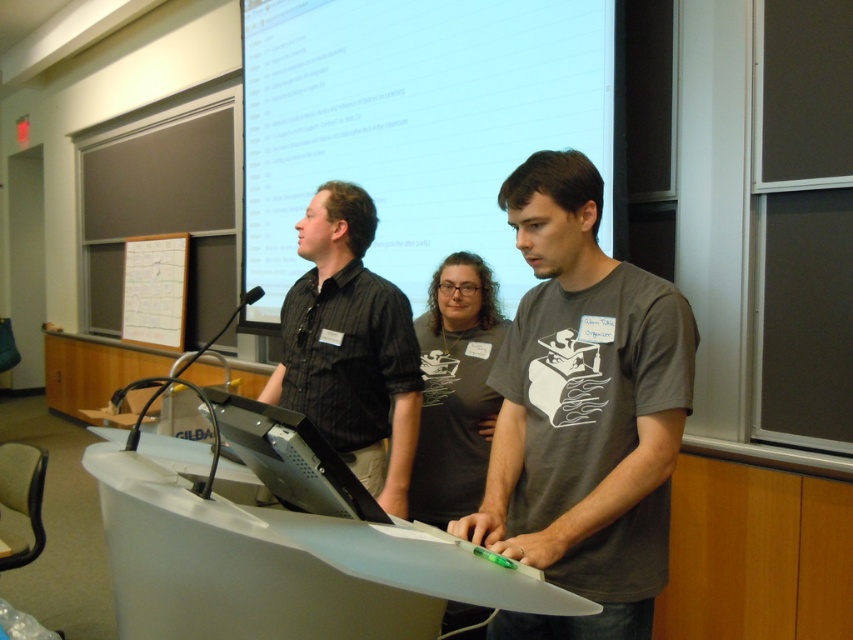
Question: Does black striped shirt at center have a lesser width compared to black glossy monitor at center?

Choices:
 (A) yes
 (B) no

Answer: (B)

Question: Estimate the real-world distances between objects in this image. Which object is closer to the black glossy monitor at center?

Choices:
 (A) black striped shirt at center
 (B) dark gray t-shirt at center

Answer: (B)

Question: Considering the real-world distances, which object is farthest from the black striped shirt at center?

Choices:
 (A) dark gray t-shirt at center
 (B) black glossy monitor at center
 (C) white matte projection screen at upper center

Answer: (C)

Question: Observing the image, what is the correct spatial positioning of white matte projection screen at upper center in reference to black glossy monitor at center?

Choices:
 (A) right
 (B) left

Answer: (A)

Question: Does white matte projection screen at upper center have a larger size compared to black striped shirt at center?

Choices:
 (A) yes
 (B) no

Answer: (A)

Question: Which of the following is the farthest from the observer?

Choices:
 (A) (509, 81)
 (B) (228, 428)
 (C) (373, 396)
 (D) (592, 394)

Answer: (A)